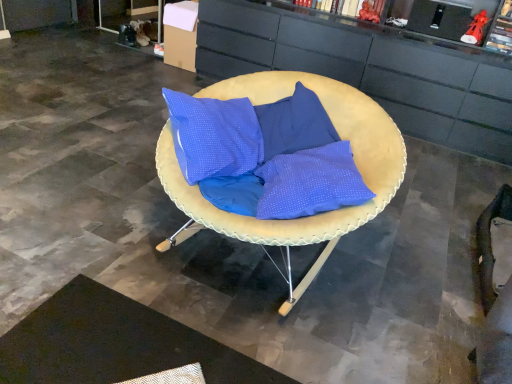
Question: Is matte yellow cushion at center oriented towards matte black cabinet at center?

Choices:
 (A) yes
 (B) no

Answer: (B)

Question: Does matte yellow cushion at center have a smaller size compared to matte black cabinet at center?

Choices:
 (A) yes
 (B) no

Answer: (A)

Question: Would you say matte yellow cushion at center is outside matte black cabinet at center?

Choices:
 (A) yes
 (B) no

Answer: (A)

Question: From a real-world perspective, is matte yellow cushion at center beneath matte black cabinet at center?

Choices:
 (A) no
 (B) yes

Answer: (B)

Question: Is matte yellow cushion at center positioned with its back to matte black cabinet at center?

Choices:
 (A) no
 (B) yes

Answer: (B)

Question: Is matte yellow cushion at center wider than matte black cabinet at center?

Choices:
 (A) no
 (B) yes

Answer: (B)

Question: Is matte yellow cushion at center wider than black textured mat at lower left?

Choices:
 (A) no
 (B) yes

Answer: (B)

Question: Is matte yellow cushion at center located outside black textured mat at lower left?

Choices:
 (A) yes
 (B) no

Answer: (A)

Question: Does matte yellow cushion at center appear on the left side of black textured mat at lower left?

Choices:
 (A) no
 (B) yes

Answer: (A)

Question: Can you confirm if matte yellow cushion at center is taller than black textured mat at lower left?

Choices:
 (A) yes
 (B) no

Answer: (A)

Question: Can you confirm if matte yellow cushion at center is smaller than black textured mat at lower left?

Choices:
 (A) no
 (B) yes

Answer: (A)

Question: Can black textured mat at lower left be found inside matte yellow cushion at center?

Choices:
 (A) no
 (B) yes

Answer: (A)

Question: From the image's perspective, is matte black cabinet at center above black textured mat at lower left?

Choices:
 (A) yes
 (B) no

Answer: (A)